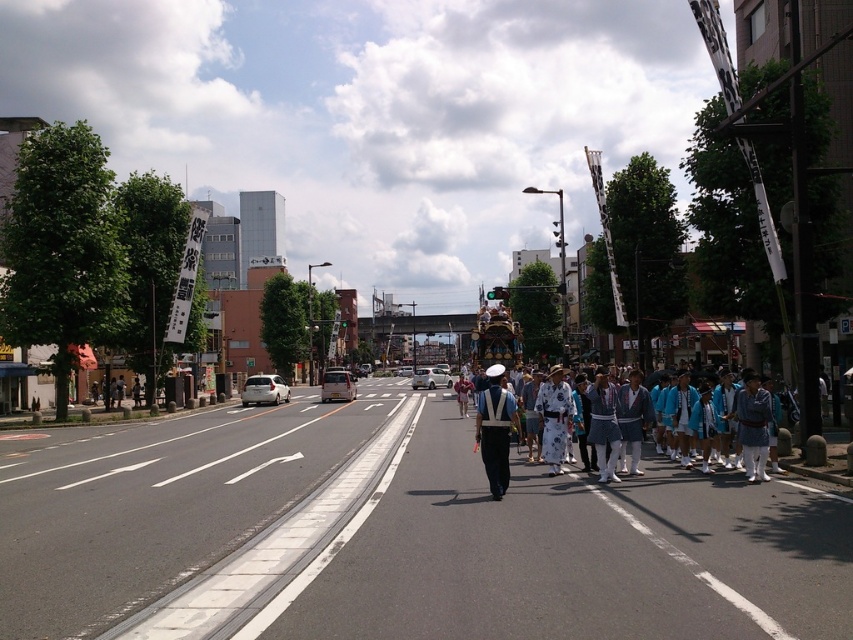
Question: Does white uniform at center have a larger size compared to matte black uniform at center?

Choices:
 (A) no
 (B) yes

Answer: (B)

Question: Is white uniform at center above matte black uniform at center?

Choices:
 (A) no
 (B) yes

Answer: (A)

Question: Which object appears farthest from the camera in this image?

Choices:
 (A) white uniform at center
 (B) matte black uniform at center

Answer: (A)

Question: Which point is farther to the camera?

Choices:
 (A) matte black uniform at center
 (B) white uniform at center

Answer: (B)

Question: Does white uniform at center lie behind matte black uniform at center?

Choices:
 (A) no
 (B) yes

Answer: (B)